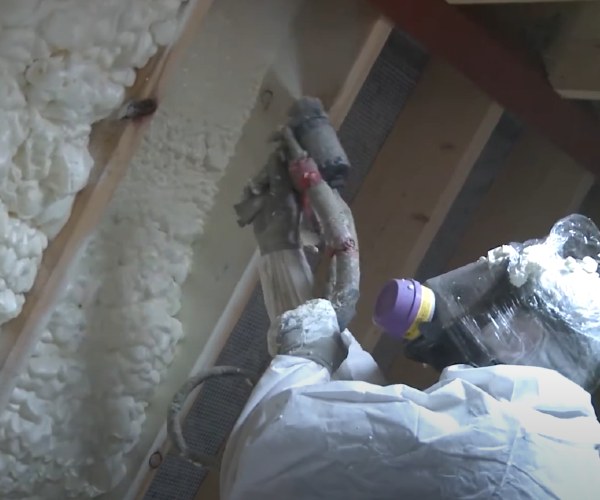
Identify the location of block of light brown wood. (448, 160).